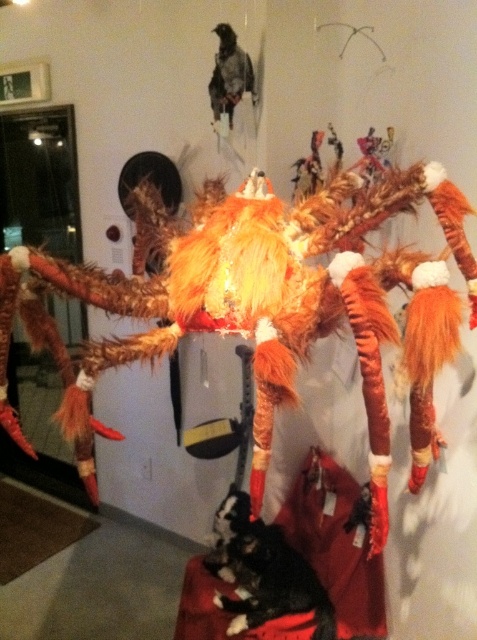
Question: Which of the following is the closest to the observer?

Choices:
 (A) (216, 56)
 (B) (242, 624)

Answer: (B)

Question: Does fuzzy orange fox at center appear on the left side of dark gray feathers at upper center?

Choices:
 (A) no
 (B) yes

Answer: (A)

Question: Can you confirm if fuzzy orange fox at center is positioned above black fur cat at lower center?

Choices:
 (A) no
 (B) yes

Answer: (B)

Question: Which point is closer to the camera?

Choices:
 (A) (173, 310)
 (B) (215, 112)

Answer: (A)

Question: Is fuzzy orange fox at center further to camera compared to dark gray feathers at upper center?

Choices:
 (A) no
 (B) yes

Answer: (A)

Question: Which object appears farthest from the camera in this image?

Choices:
 (A) fuzzy orange fox at center
 (B) dark gray feathers at upper center

Answer: (B)